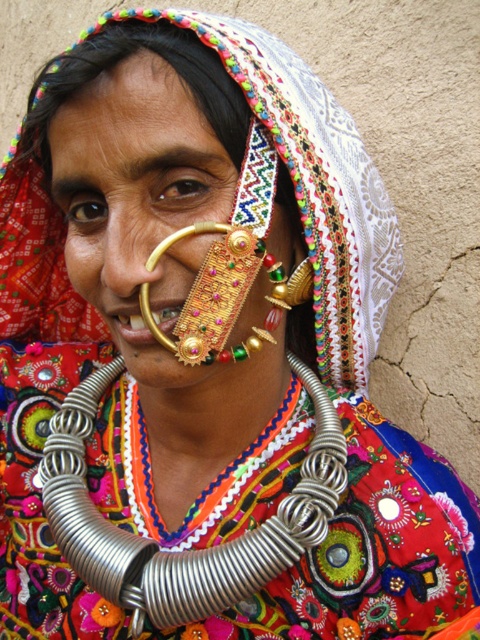
Who is more forward, (155, 378) or (180, 321)?

Point (180, 321) is in front.

Does gold/embellished/earring at center have a greater width compared to gold/golden metal/earring at center?

Indeed, gold/embellished/earring at center has a greater width compared to gold/golden metal/earring at center.

Which is in front, point (76, 163) or point (250, 275)?

Point (76, 163) is more forward.

Image resolution: width=480 pixels, height=640 pixels. In order to click on gold/embellished/earring at center in this screenshot , I will do `click(136, 198)`.

Who is positioned more to the right, gold/embellished/earring at center or silver/metallic necklace at center?

From the viewer's perspective, silver/metallic necklace at center appears more on the right side.

Locate an element on the screen. gold/embellished/earring at center is located at coordinates (136, 198).

This screenshot has height=640, width=480. Find the location of `gold/embellished/earring at center`. gold/embellished/earring at center is located at coordinates (136, 198).

Is the position of silver/metallic necklace at center more distant than that of gold/golden metal/earring at center?

That is True.

Who is lower down, silver/metallic necklace at center or gold/golden metal/earring at center?

Positioned lower is silver/metallic necklace at center.

Between point (310, 476) and point (201, 296), which one is positioned behind?

Positioned behind is point (310, 476).

Find the location of a particular element. This screenshot has height=640, width=480. silver/metallic necklace at center is located at coordinates (182, 550).